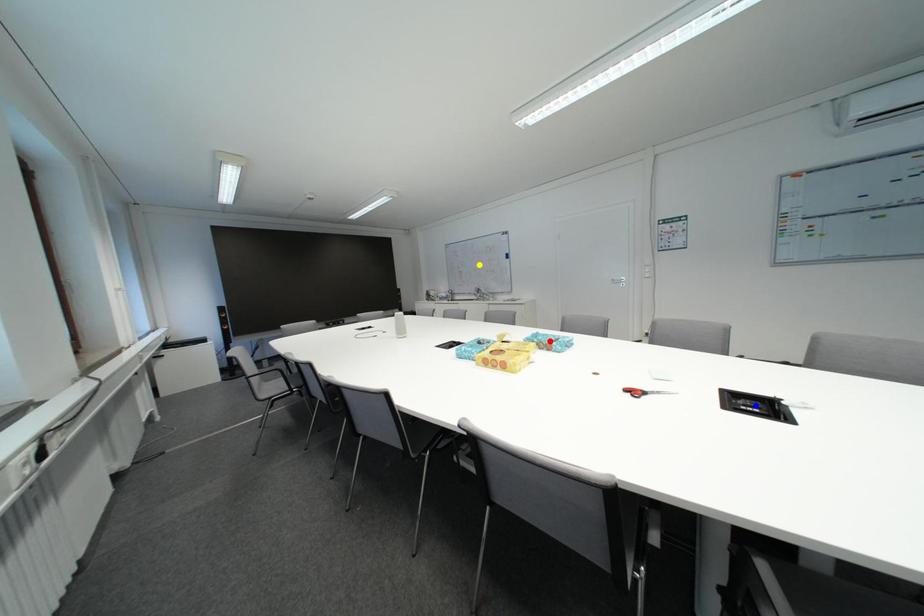
Order these from nearest to farthest:
- yellow point
- red point
- blue point

yellow point, red point, blue point